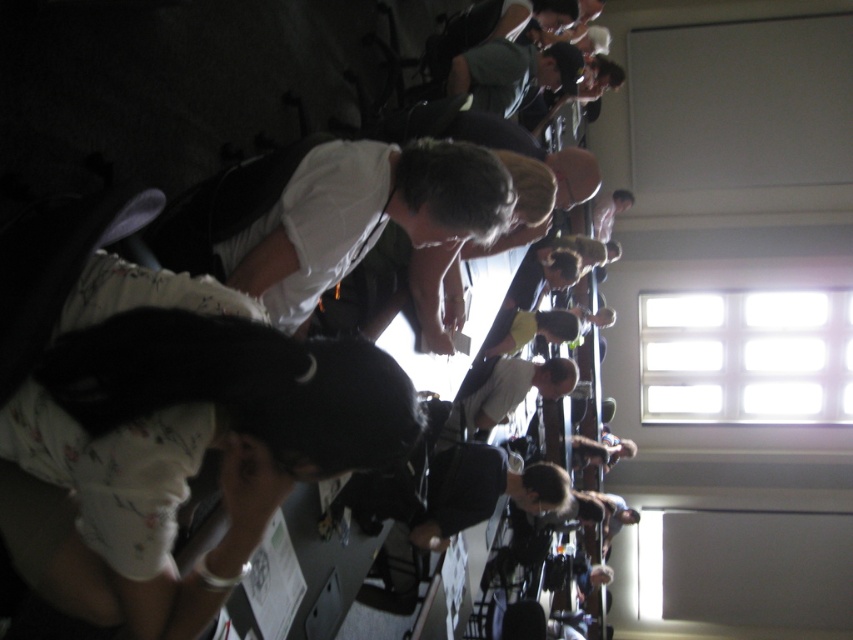
This screenshot has height=640, width=853. Describe the element at coordinates (328, 214) in the screenshot. I see `white matte shirt at center` at that location.

This screenshot has height=640, width=853. What do you see at coordinates (328, 214) in the screenshot?
I see `white matte shirt at center` at bounding box center [328, 214].

Where is `white matte shirt at center`? This screenshot has width=853, height=640. white matte shirt at center is located at coordinates (328, 214).